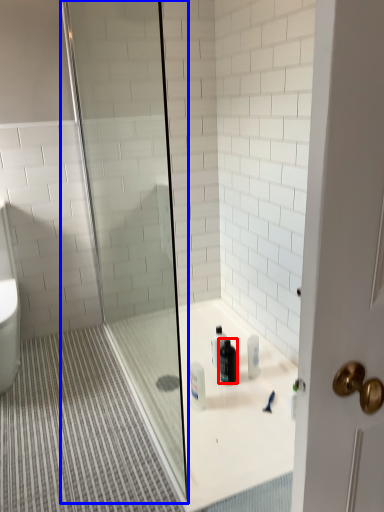
Question: Which object is further to the camera taking this photo, cleaning product (highlighted by a red box) or shower door (highlighted by a blue box)?

Choices:
 (A) cleaning product
 (B) shower door

Answer: (A)